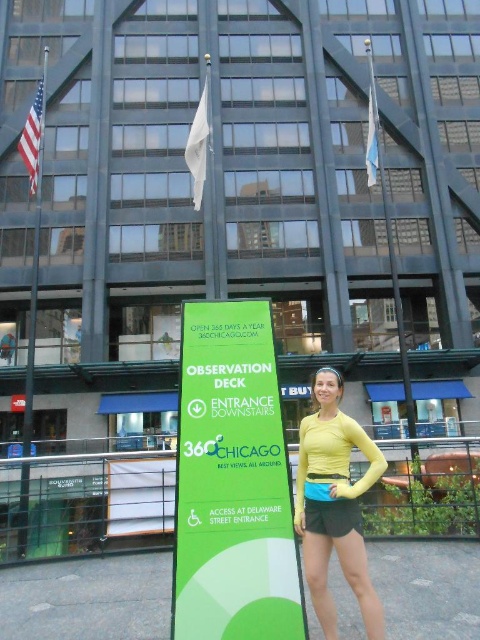
Question: Which of the following is the closest to the observer?

Choices:
 (A) yellow matte long-sleeve shirt at center
 (B) green matte sign at center
 (C) metallic flagpole at left

Answer: (B)

Question: Can you confirm if yellow matte long-sleeve shirt at center is positioned to the left of metallic flagpole at left?

Choices:
 (A) no
 (B) yes

Answer: (A)

Question: Can you confirm if green matte sign at center is positioned above metallic flagpole at left?

Choices:
 (A) yes
 (B) no

Answer: (B)

Question: Which of the following is the farthest from the observer?

Choices:
 (A) (47, 65)
 (B) (345, 564)
 (C) (253, 506)

Answer: (A)

Question: Among these points, which one is farthest from the camera?

Choices:
 (A) (269, 429)
 (B) (317, 538)

Answer: (A)

Question: Can you confirm if green matte sign at center is wider than yellow matte long-sleeve shirt at center?

Choices:
 (A) no
 (B) yes

Answer: (B)